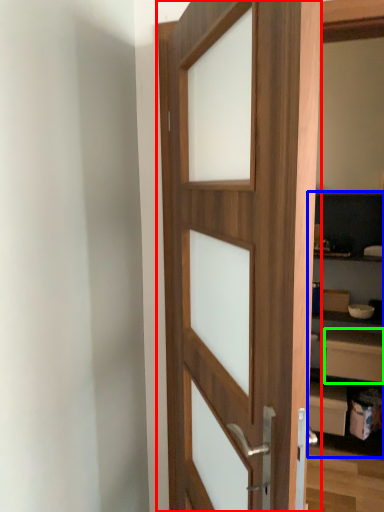
Question: Which object is positioned farthest from door (highlighted by a red box)? Select from bookshelf (highlighted by a blue box) and drawer (highlighted by a green box).

Choices:
 (A) bookshelf
 (B) drawer

Answer: (B)